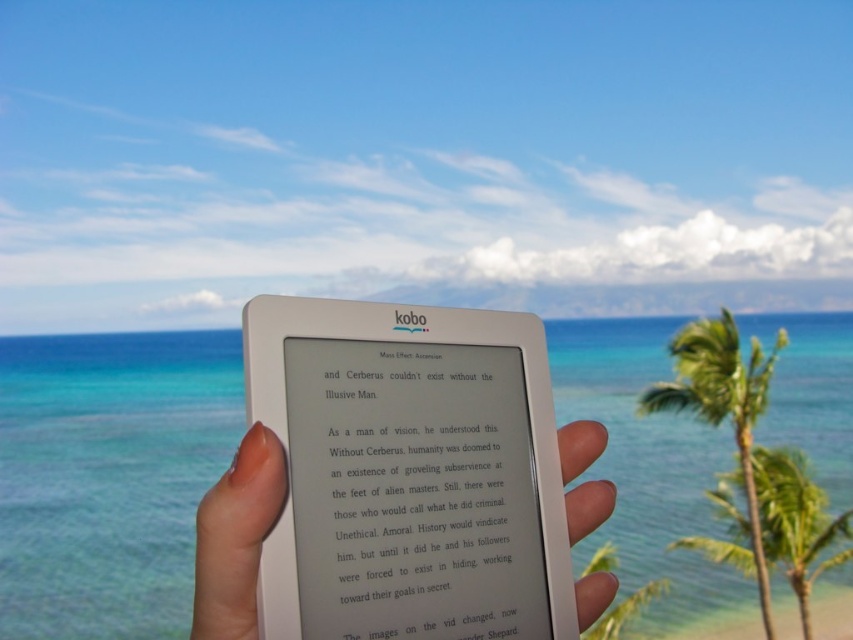
Looking at the scene with the smooth skin hand at center and the green leafy palm tree at right, which object is positioned more to the right side?

The green leafy palm tree at right is positioned more to the right side.

You are a photographer trying to capture a photo of the green leafy palm tree at right while holding the Kobo e_reader in your smooth skin hand at center. Can you fit both the palm tree and the e_reader in the frame without moving your hand? Explain your reasoning.

The smooth skin hand at center and green leafy palm tree at right are 2.26 meters apart. Since the distance between them is significant, it might be challenging to fit both in the same frame without adjusting the camera angle or zoom. However, depending on the camera lens and field of view, it could be possible if the lens has a wide enough angle to capture both objects separated by that distance simultaneously.

You are a photographer trying to capture the smooth skin hand at center and the green leafy palm tree at right in a single frame. Based on their positions, which object should appear lower in the photo?

The green leafy palm tree at right appears lower in the photo because the smooth skin hand at center is located above it.